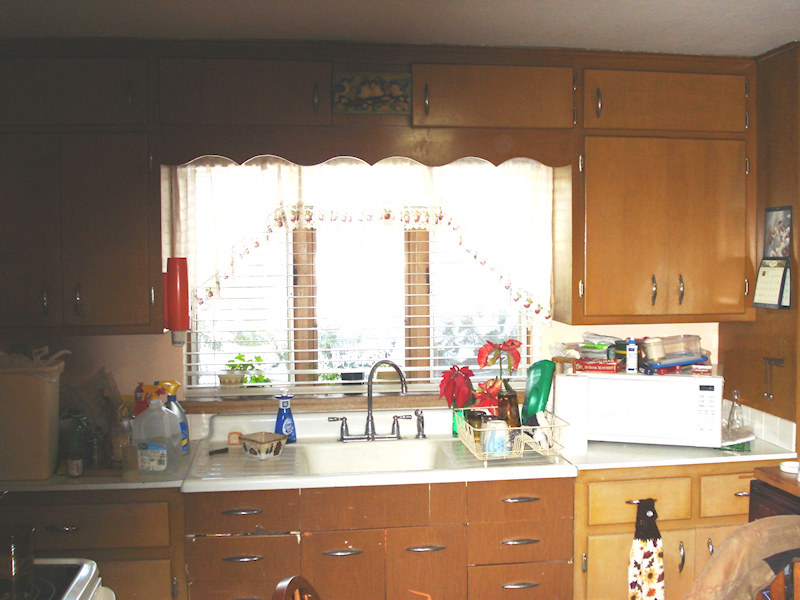
Where is `dish sprayer handle`? The width and height of the screenshot is (800, 600). dish sprayer handle is located at coordinates (421, 421).